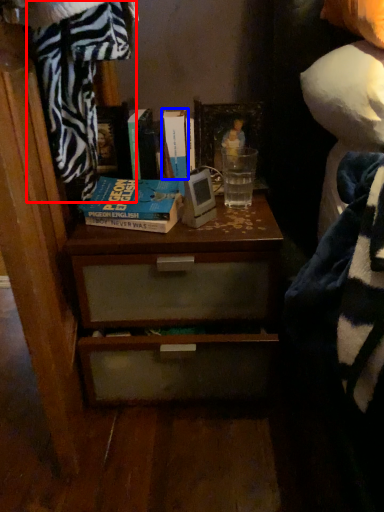
Question: Which point is closer to the camera, blanket (highlighted by a red box) or book (highlighted by a blue box)?

Choices:
 (A) blanket
 (B) book

Answer: (A)